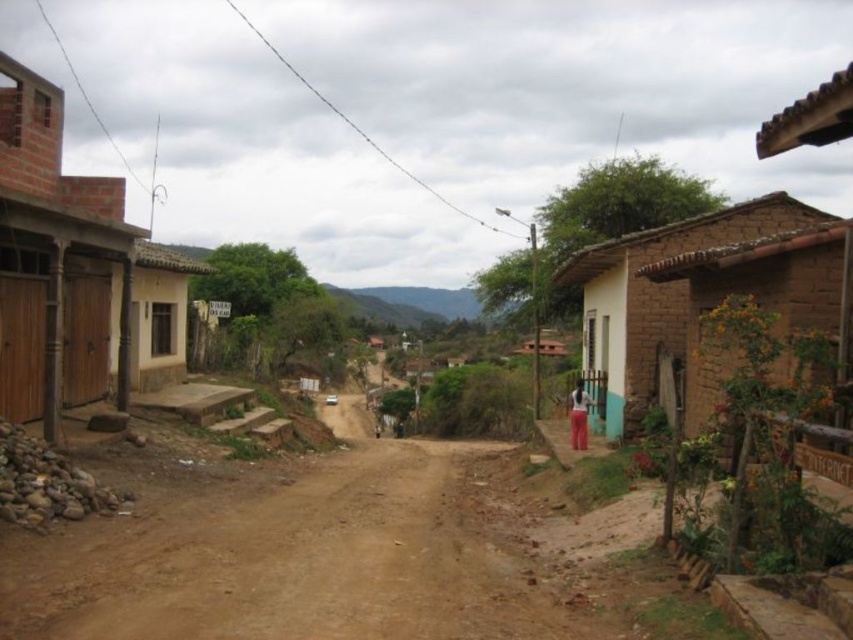
Based on the photo, you are a traveler carrying a backpack and need to reach the brown clay hut at right from the brown brick hut at left. Given that your backpack can only hold enough water for a 30 feet journey, will you be able to make it without needing to refill?

The brown brick hut at left is 34.52 feet away from the brown clay hut at right. Since your backpack can only hold enough water for 30 feet, you will need to refill before reaching the brown clay hut at right.

You are standing on the dirt road in the rural scene. You see a brown brick hut at left and a brown clay hut at right. Which one is directly above the other?

The brown brick hut at left is positioned under the brown clay hut at right, so the brown clay hut at right is directly above the brown brick hut at left.

You are a traveler standing on the dirt road in the village. You need to decide which direction to go next. Which building, the brown brick hut at left or the brown clay hut at right, is taller and might offer a better view of the surrounding area?

The brown brick hut at left is taller than the brown clay hut at right, so it might offer a better view of the surrounding area.